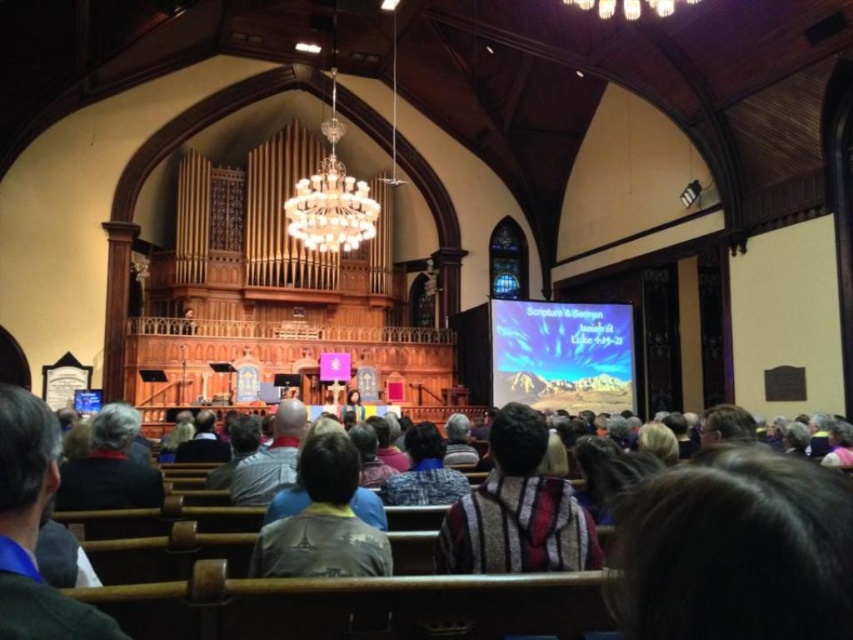
You are standing at the entrance of the church and notice the multicolored woven fabric at center. Based on its coordinates, can you determine if it is placed closer to the front or the back of the sanctuary?

The multicolored woven fabric at center is located at point 0.898 on the x and y axis, which means it is closer to the back of the sanctuary since the entrance is at the front.

You are attending a church service and notice two people sitting in front of you. One is wearing a camouflage jacket at center and the other a gray fabric shirt at center. Which person is closer to the front of the church?

The camouflage jacket at center is closer to the front of the church because it is in front of the gray fabric shirt at center.